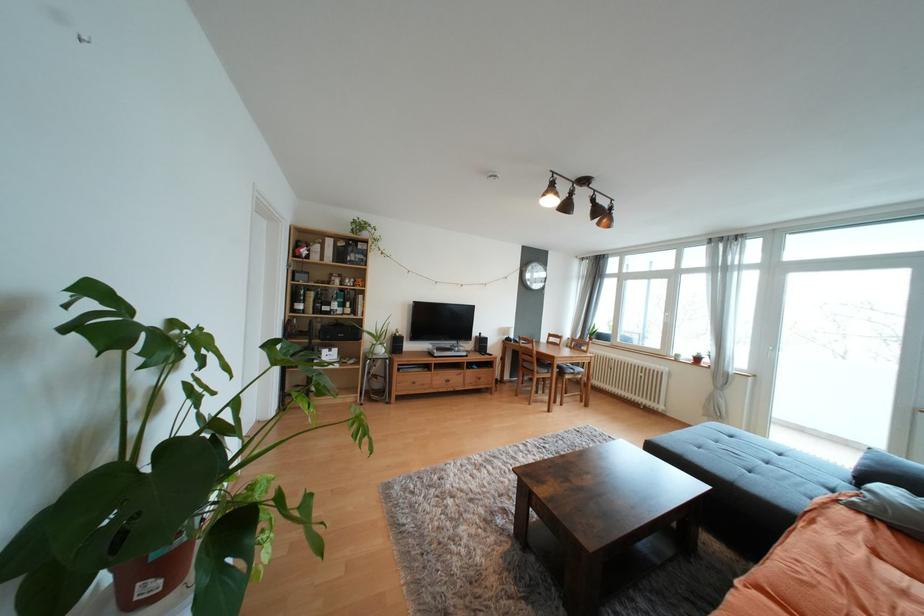
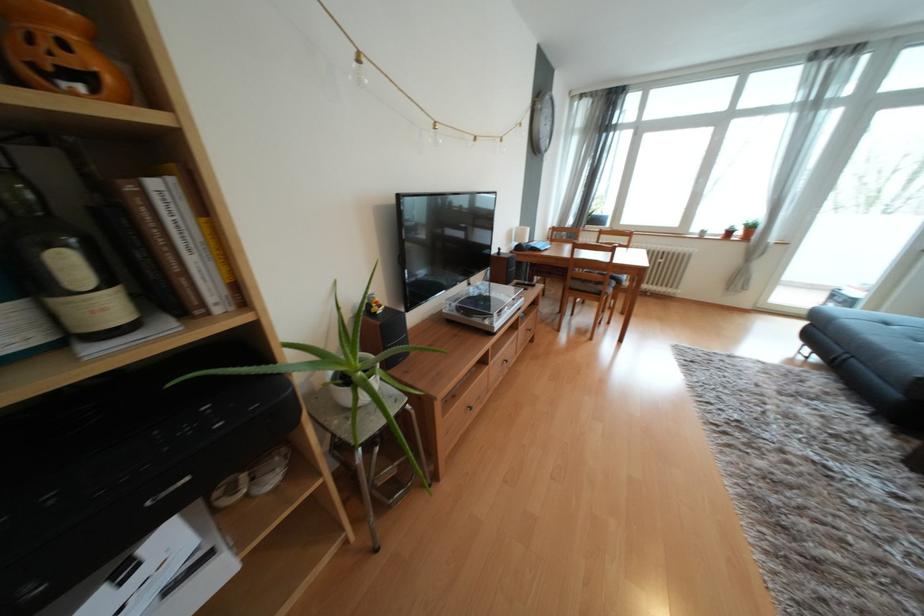
In the second image, find the point that corresponds to (x=354, y=312) in the first image.

(111, 308)